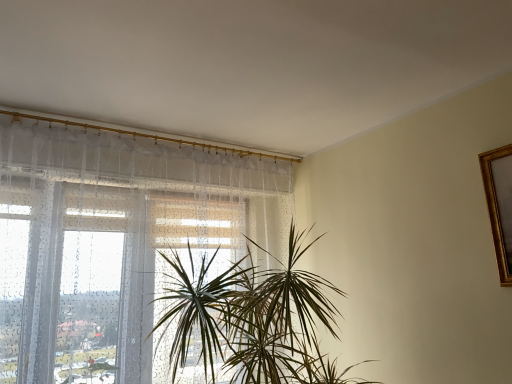
Question: Is transparent fabric at left to the right of green leafy plant at center from the viewer's perspective?

Choices:
 (A) yes
 (B) no

Answer: (B)

Question: Is transparent fabric at left shorter than green leafy plant at center?

Choices:
 (A) yes
 (B) no

Answer: (B)

Question: Can green leafy plant at center be found inside transparent fabric at left?

Choices:
 (A) no
 (B) yes

Answer: (A)

Question: Is the position of transparent fabric at left more distant than that of green leafy plant at center?

Choices:
 (A) no
 (B) yes

Answer: (B)

Question: Is transparent fabric at left closer to camera compared to green leafy plant at center?

Choices:
 (A) yes
 (B) no

Answer: (B)

Question: From the image's perspective, is transparent fabric at left located beneath green leafy plant at center?

Choices:
 (A) no
 (B) yes

Answer: (A)

Question: Is green leafy plant at center wider than transparent fabric at left?

Choices:
 (A) yes
 (B) no

Answer: (A)

Question: Could you tell me if green leafy plant at center is turned towards transparent fabric at left?

Choices:
 (A) no
 (B) yes

Answer: (A)

Question: Is green leafy plant at center facing away from transparent fabric at left?

Choices:
 (A) yes
 (B) no

Answer: (B)

Question: Is green leafy plant at center taller than transparent fabric at left?

Choices:
 (A) yes
 (B) no

Answer: (B)

Question: Could transparent fabric at left be considered to be inside green leafy plant at center?

Choices:
 (A) yes
 (B) no

Answer: (B)

Question: Is green leafy plant at center smaller than transparent fabric at left?

Choices:
 (A) yes
 (B) no

Answer: (B)

Question: Is transparent fabric at left wider or thinner than green leafy plant at center?

Choices:
 (A) wide
 (B) thin

Answer: (B)